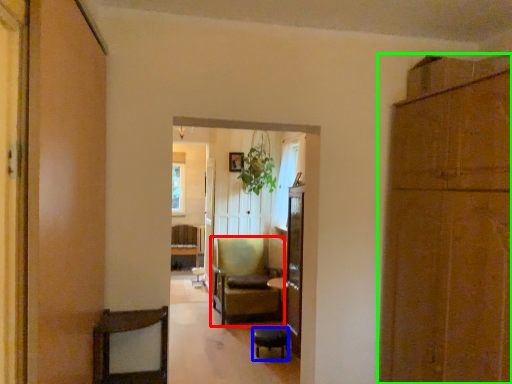
Question: Which is farther away from chair (highlighted by a red box)? bar stool (highlighted by a blue box) or cabinetry (highlighted by a green box)?

Choices:
 (A) bar stool
 (B) cabinetry

Answer: (B)